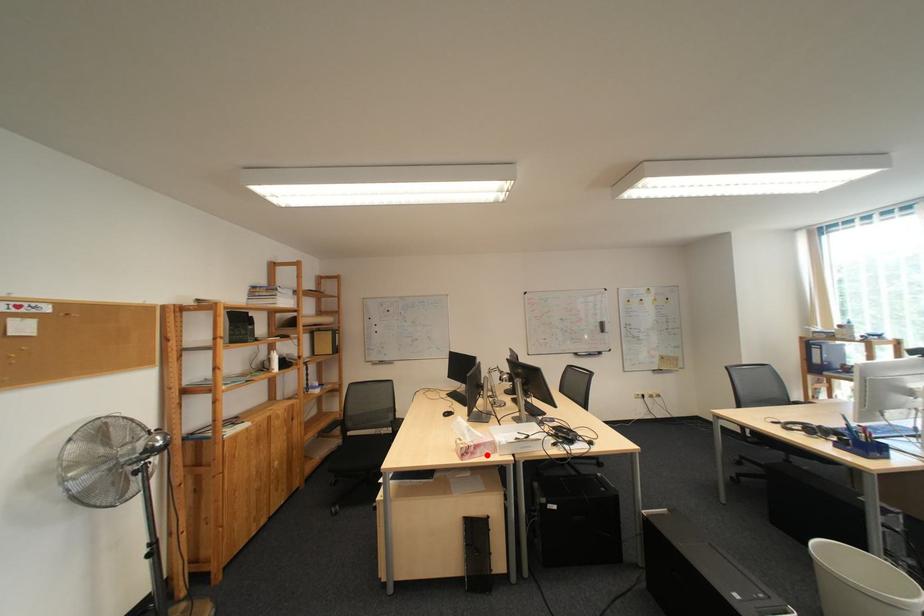
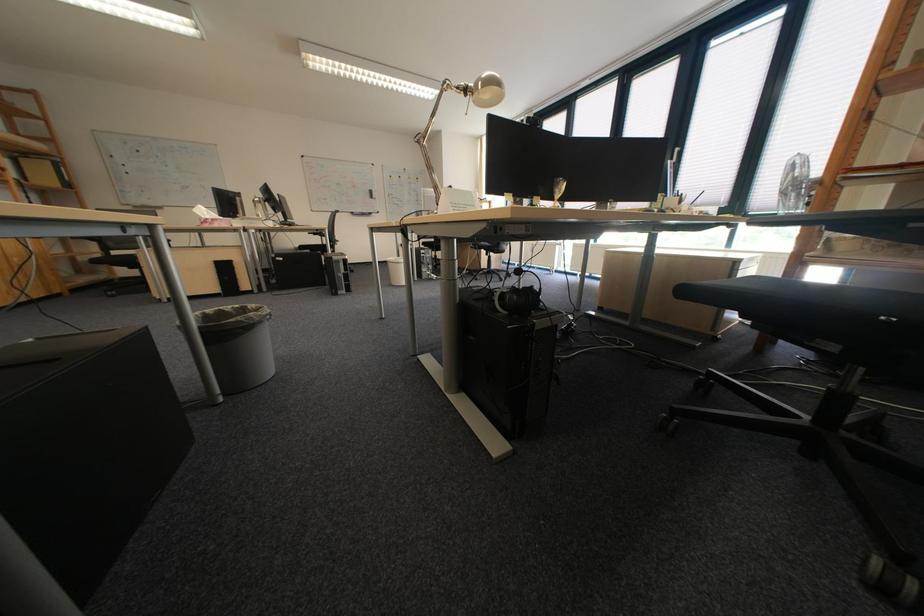
Find the pixel in the second image that matches the highlighted location in the first image.

(225, 225)